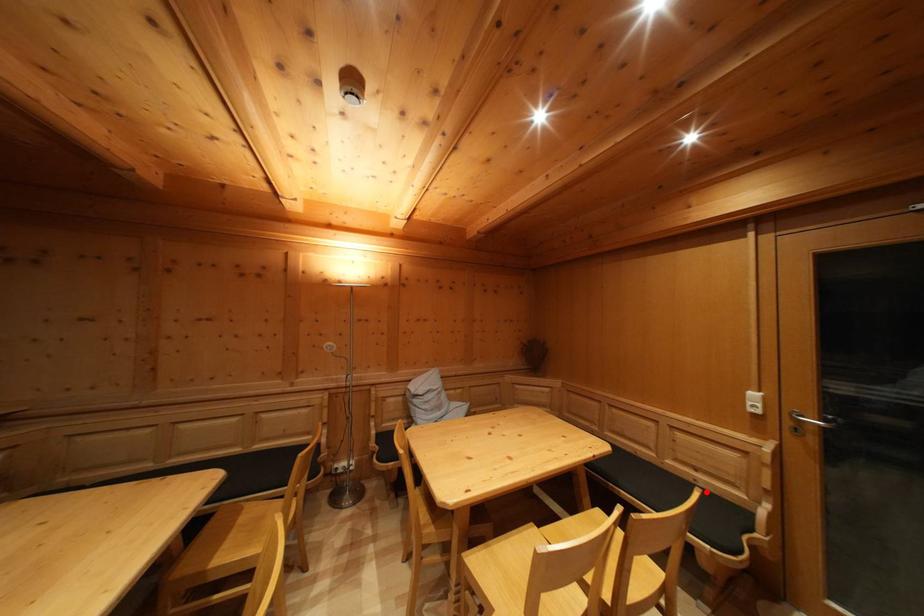
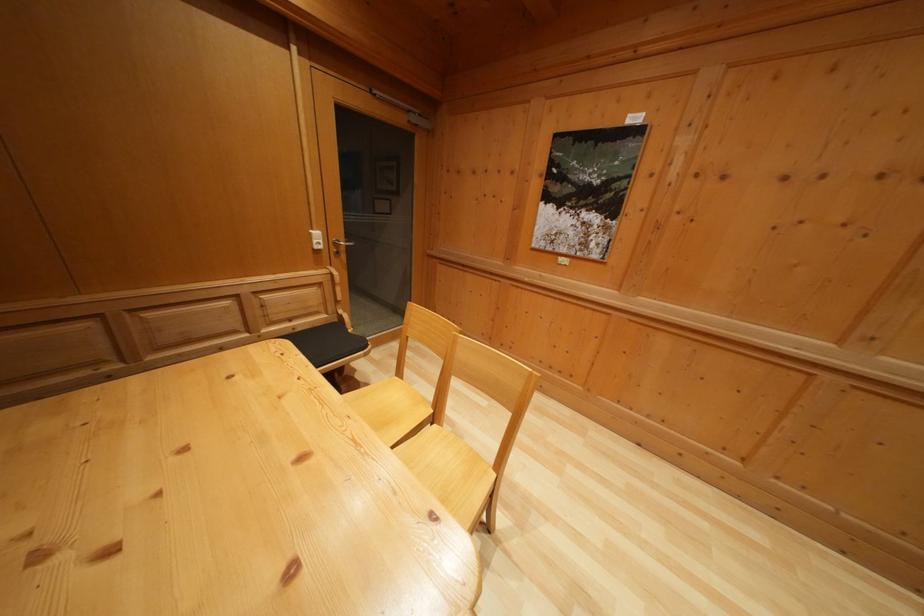
Locate, in the second image, the point that corresponds to the highlighted location in the first image.

(305, 336)